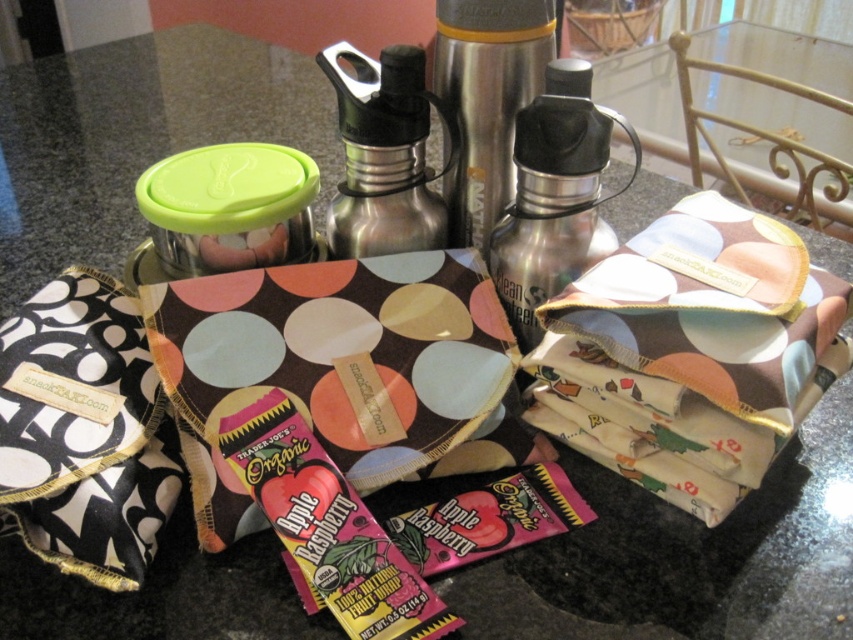
Is shiny metallic water bottle at center further to the viewer compared to silver metallic thermos at center?

No, it is not.

Does shiny metallic water bottle at center have a greater height compared to silver metallic thermos at center?

Yes, shiny metallic water bottle at center is taller than silver metallic thermos at center.

Is point (556, 182) behind point (415, 230)?

No, it is in front of (415, 230).

Locate an element on the screen. shiny metallic water bottle at center is located at coordinates (554, 195).

Which of these two, silver metallic thermos at center or stainless steel thermos at center, stands taller?

Standing taller between the two is stainless steel thermos at center.

Is silver metallic thermos at center bigger than stainless steel thermos at center?

No.

This screenshot has height=640, width=853. I want to click on silver metallic thermos at center, so click(x=386, y=154).

The image size is (853, 640). Identify the location of silver metallic thermos at center. (386, 154).

The image size is (853, 640). What do you see at coordinates (692, 353) in the screenshot?
I see `brown fabric pouch at center` at bounding box center [692, 353].

Who is more distant from viewer, (686, 356) or (407, 157)?

Positioned behind is point (407, 157).

Find the location of `brown fabric pouch at center`. brown fabric pouch at center is located at coordinates (692, 353).